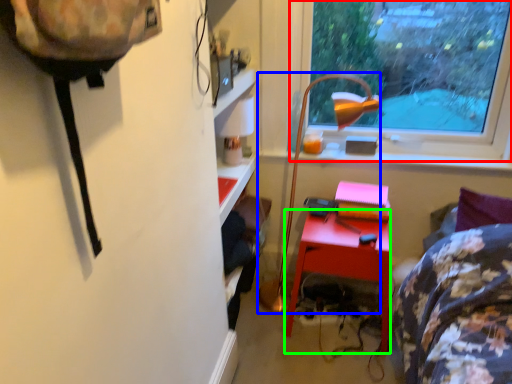
Question: Which object is positioned farthest from window (highlighted by a red box)? Select from lamp (highlighted by a blue box) and desk (highlighted by a green box).

Choices:
 (A) lamp
 (B) desk

Answer: (B)